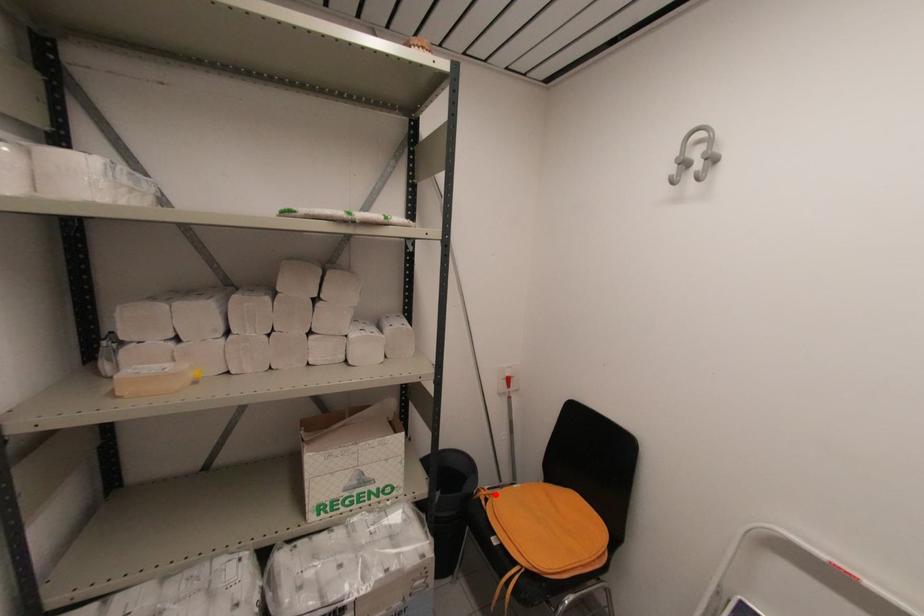
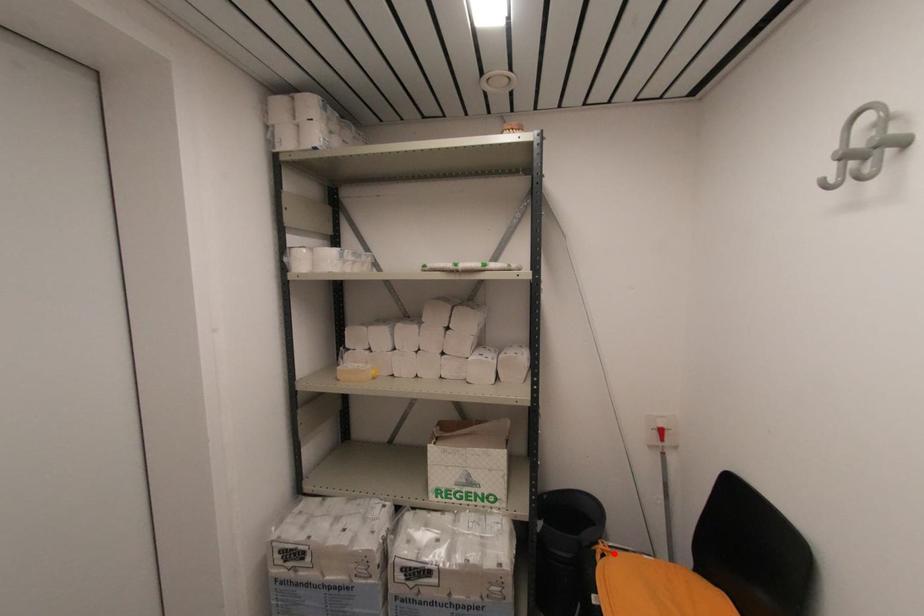
I am providing you with two images of the same scene from different viewpoints. A red point is marked on the first image and another point is marked on the second image. Does the point marked in image1 correspond to the same location as the one in image2?

Yes